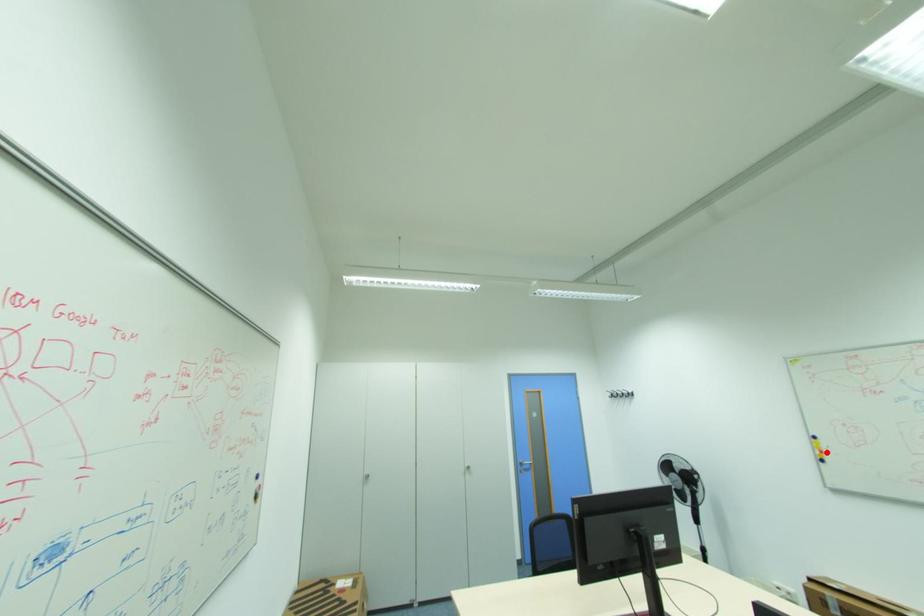
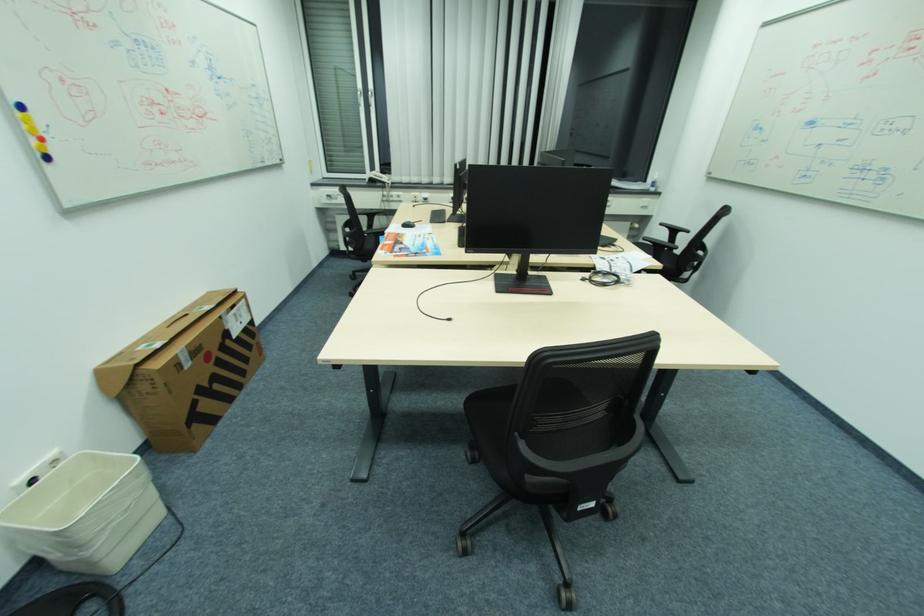
Question: I am providing you with two images of the same scene from different viewpoints. In image1, a red point is highlighted. Considering the same 3D point in image2, which of the following is correct?

Choices:
 (A) It is closer
 (B) It is farther

Answer: (B)